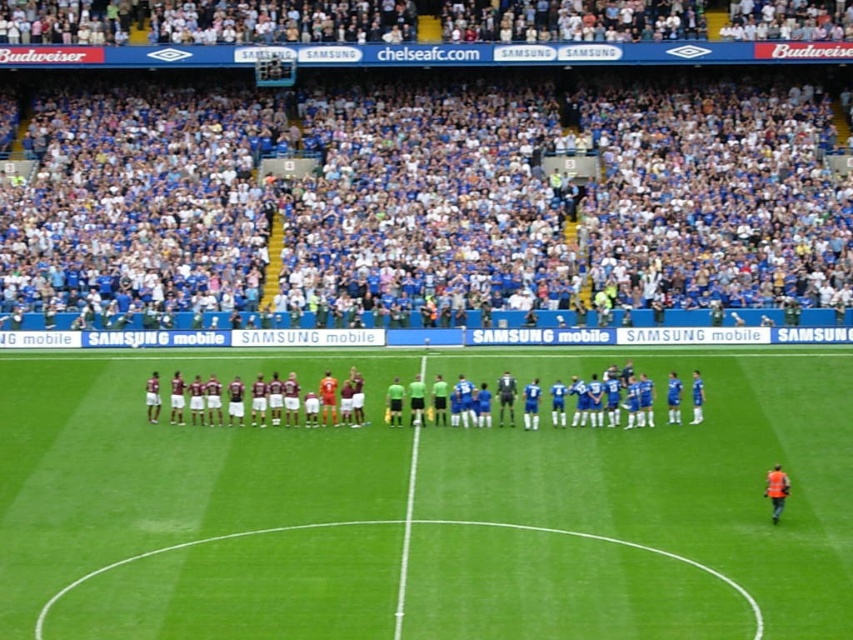
Identify the location of green grass football field at center. Image resolution: width=853 pixels, height=640 pixels. (424, 508).

Between point (292, 445) and point (352, 216), which one is positioned in front?

Point (292, 445) is in front.

At what (x,y) coordinates should I click in order to perform the action: click on green grass football field at center. Please return your answer as a coordinate pair (x, y). Looking at the image, I should click on (424, 508).

Between green grass football field at center and green grass line at center, which one is positioned lower?

green grass line at center is lower down.

Between green grass football field at center and green grass line at center, which one appears on the right side from the viewer's perspective?

From the viewer's perspective, green grass football field at center appears more on the right side.

You are a GUI agent. You are given a task and a screenshot of the screen. Output one action in this format:
    pyautogui.click(x=<x>, y=<y>)
    Task: Click on the green grass football field at center
    The width and height of the screenshot is (853, 640).
    Given the screenshot: What is the action you would take?
    pyautogui.click(x=424, y=508)

Is maroon jersey at center to the left of green grass line at center from the viewer's perspective?

Yes, maroon jersey at center is to the left of green grass line at center.

Which is above, maroon jersey at center or green grass line at center?

maroon jersey at center

You are a GUI agent. You are given a task and a screenshot of the screen. Output one action in this format:
    pyautogui.click(x=<x>, y=<y>)
    Task: Click on the maroon jersey at center
    This screenshot has width=853, height=640.
    Given the screenshot: What is the action you would take?
    pyautogui.click(x=202, y=396)